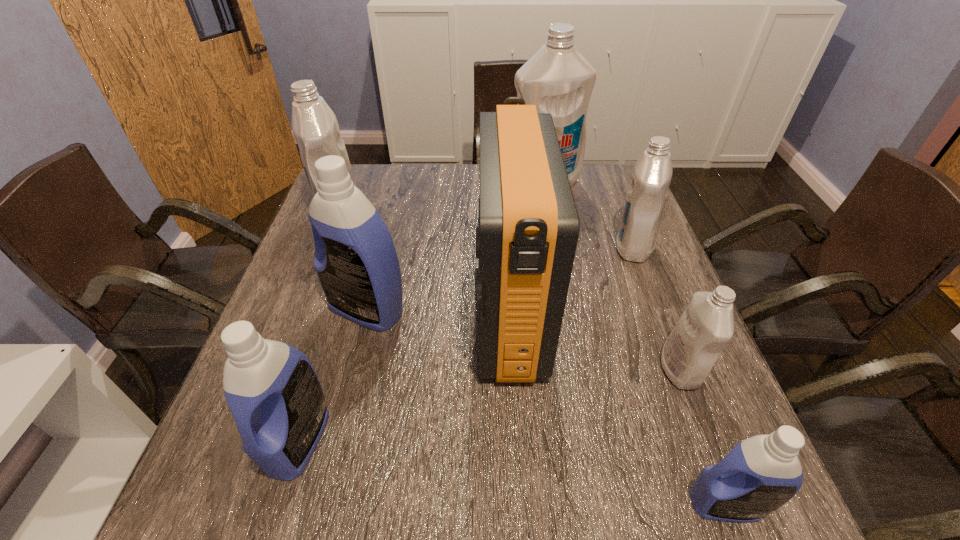
In order to click on the fourth detergent from left to right in this screenshot , I will do `click(557, 79)`.

In order to click on the tallest detergent in this screenshot , I will do `click(557, 79)`.

Identify the location of radio receiver. Image resolution: width=960 pixels, height=540 pixels. (528, 226).

You are a GUI agent. You are given a task and a screenshot of the screen. Output one action in this format:
    pyautogui.click(x=<x>, y=<y>)
    Task: Click on the third smallest white detergent
    The width and height of the screenshot is (960, 540).
    Given the screenshot: What is the action you would take?
    click(315, 127)

At what (x,y) coordinates should I click in order to perform the action: click on the biggest blue detergent. Please return your answer as a coordinate pair (x, y). The image size is (960, 540). Looking at the image, I should click on pos(355,259).

Identify the location of the fourth farthest detergent. This screenshot has width=960, height=540. (355, 259).

Locate an element on the screen. This screenshot has width=960, height=540. the second smallest white detergent is located at coordinates (647, 194).

Locate an element on the screen. The height and width of the screenshot is (540, 960). the second biggest blue detergent is located at coordinates (274, 394).

The image size is (960, 540). Identify the location of the smallest white detergent. (706, 326).

At what (x,y) coordinates should I click in order to perform the action: click on the fifth farthest detergent. Please return your answer as a coordinate pair (x, y). Looking at the image, I should click on (x=706, y=326).